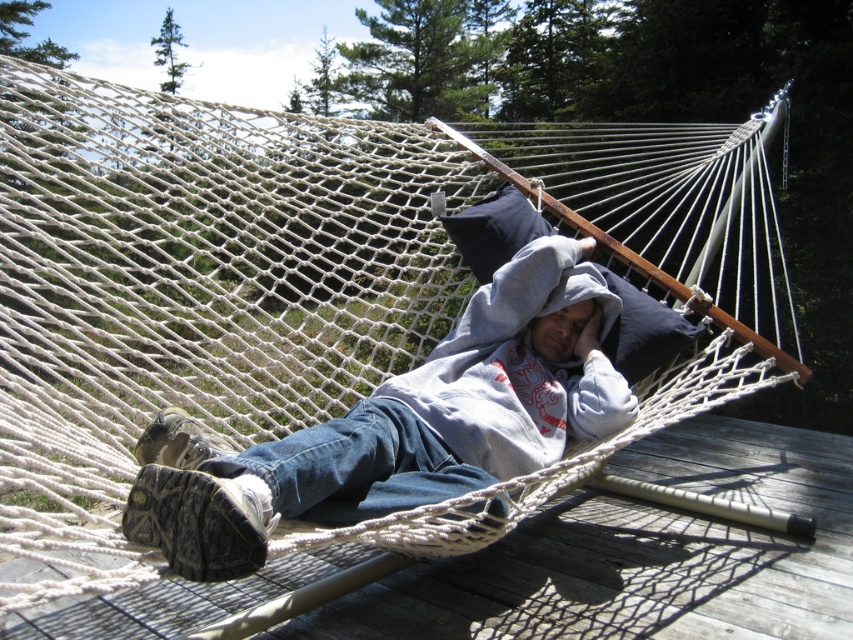
Which is more to the left, wooden deck at center or gray fleece hoodie at center?

gray fleece hoodie at center is more to the left.

Can you confirm if wooden deck at center is taller than gray fleece hoodie at center?

No, wooden deck at center is not taller than gray fleece hoodie at center.

Does point (80, 625) come farther from viewer compared to point (570, 260)?

No, it is not.

Identify the location of wooden deck at center. This screenshot has width=853, height=640. (641, 554).